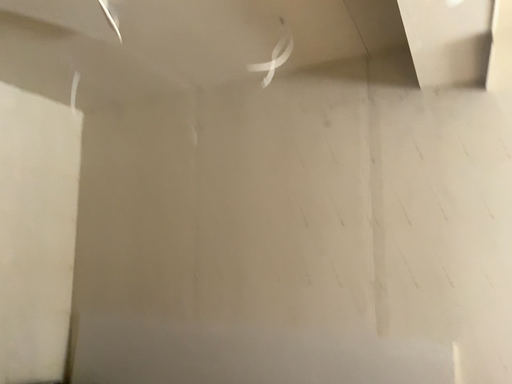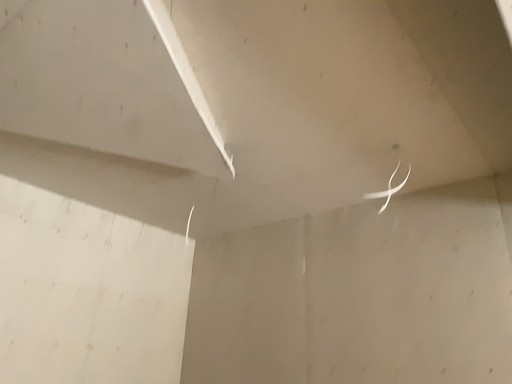
Question: Which way did the camera rotate in the video?

Choices:
 (A) rotated right
 (B) rotated left

Answer: (B)